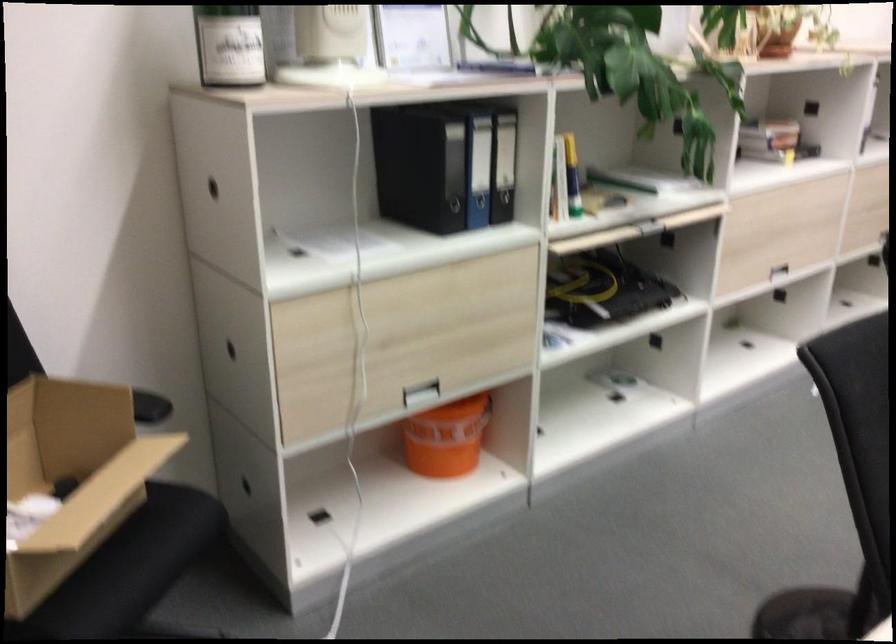
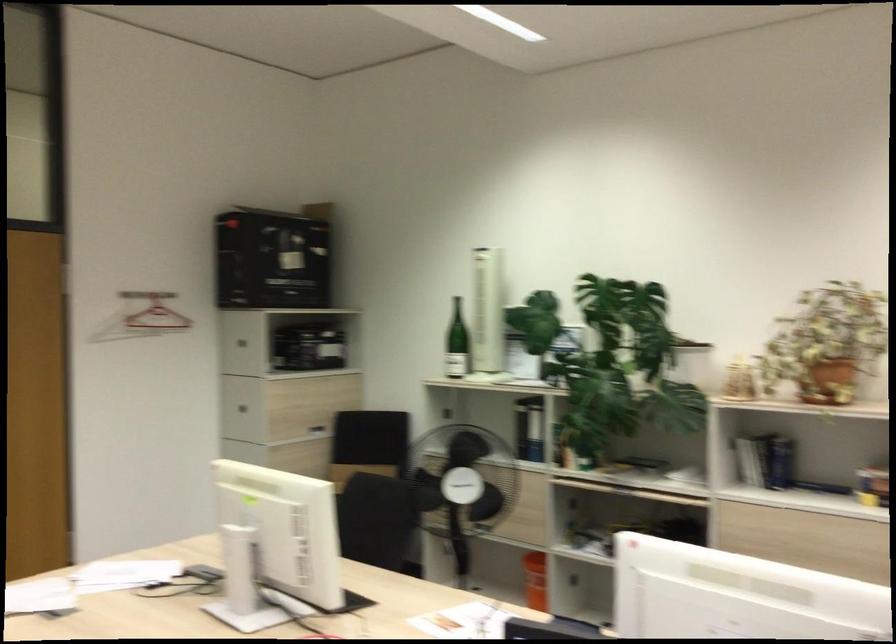
Question: I am providing you with two images of the same scene from different viewpoints. Which of the following objects are not visible in image2?

Choices:
 (A) blue binder
 (B) chair sitting surface
 (C) clear glass bowl
 (D) orange bucket

Answer: (A)